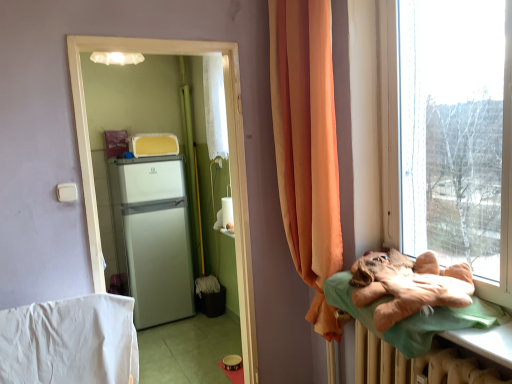
Question: In terms of height, does white matte refrigerator at left look taller or shorter compared to white glossy refrigerator at center?

Choices:
 (A) short
 (B) tall

Answer: (A)

Question: From a real-world perspective, is white matte refrigerator at left positioned above or below white glossy refrigerator at center?

Choices:
 (A) below
 (B) above

Answer: (A)

Question: Estimate the real-world distances between objects in this image. Which object is closer to the orange fabric curtain at right?

Choices:
 (A) white glossy refrigerator at center
 (B) white cotton blanket at lower left
 (C) brown plush bear at right
 (D) white matte refrigerator at left

Answer: (A)

Question: Considering the real-world distances, which object is farthest from the white cotton blanket at lower left?

Choices:
 (A) brown plush bear at right
 (B) orange fabric curtain at right
 (C) white matte refrigerator at left
 (D) white glossy refrigerator at center

Answer: (C)